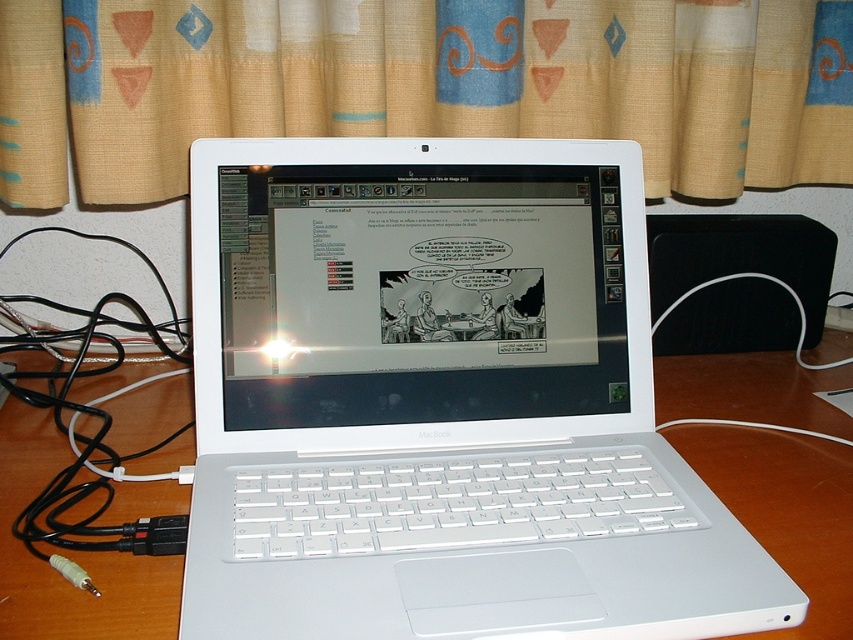
Does white plastic laptop at center have a greater width compared to beige fabric curtain at upper center?

Incorrect, white plastic laptop at center's width does not surpass beige fabric curtain at upper center's.

Is point (619, 333) in front of point (68, 100)?

Yes, it is.

This screenshot has width=853, height=640. Find the location of `white plastic laptop at center`. white plastic laptop at center is located at coordinates (440, 403).

Identify the location of white plastic laptop at center. (440, 403).

Is beige fabric curtain at upper center smaller than white glossy laptop screen at center?

Actually, beige fabric curtain at upper center might be larger than white glossy laptop screen at center.

Which is in front, point (288, 64) or point (567, 387)?

Point (567, 387) is in front.

Locate an element on the screen. The image size is (853, 640). beige fabric curtain at upper center is located at coordinates (422, 84).

Is beige fabric curtain at upper center further to camera compared to black cable at left?

That is True.

Does point (260, 86) come behind point (177, 429)?

Yes, it is behind point (177, 429).

Find the location of a particular element. beige fabric curtain at upper center is located at coordinates (422, 84).